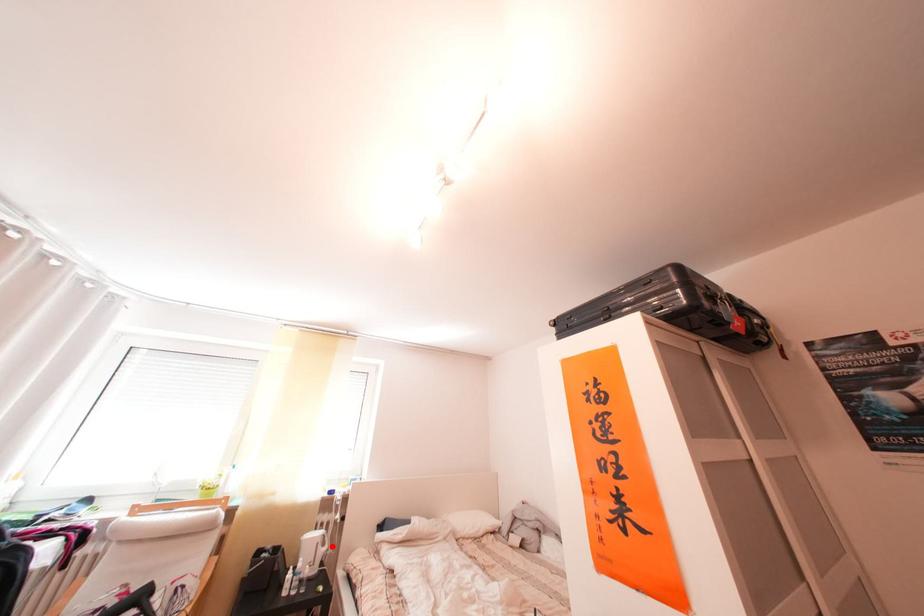
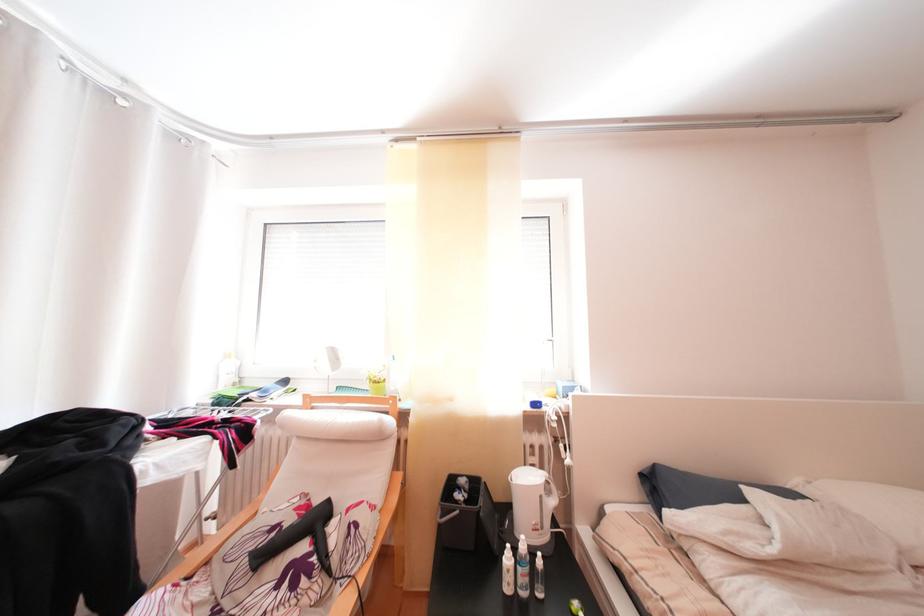
Locate, in the second image, the point that corresponds to the highlighted location in the first image.

(554, 498)